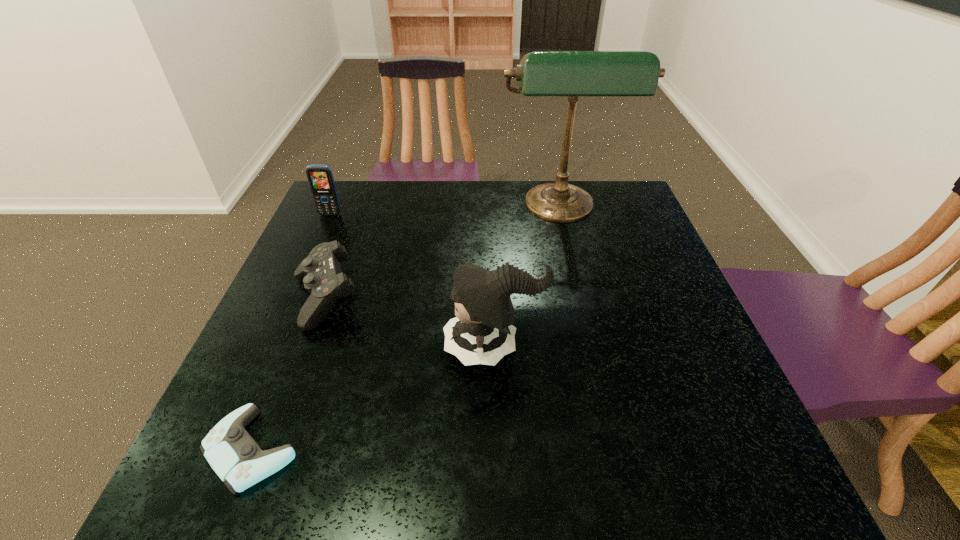
At what (x,y) coordinates should I click in order to perform the action: click on object that is at the near left corner. Please return your answer as a coordinate pair (x, y). Looking at the image, I should click on (233, 454).

Locate an element on the screen. object present at the far right corner is located at coordinates (541, 73).

You are a GUI agent. You are given a task and a screenshot of the screen. Output one action in this format:
    pyautogui.click(x=<x>, y=<y>)
    Task: Click on the free location at the far edge
    
    Given the screenshot: What is the action you would take?
    pyautogui.click(x=467, y=218)

I want to click on free region at the near edge of the desktop, so click(351, 480).

At what (x,y) coordinates should I click in order to perform the action: click on vacant space at the left edge of the desktop. Please return your answer as a coordinate pair (x, y). The height and width of the screenshot is (540, 960). Looking at the image, I should click on (285, 410).

This screenshot has width=960, height=540. I want to click on free region at the right edge of the desktop, so click(695, 392).

The height and width of the screenshot is (540, 960). Find the location of `free location at the far left corner of the desktop`. free location at the far left corner of the desktop is located at coordinates (365, 185).

This screenshot has height=540, width=960. In order to click on vacant space at the near left corner of the desktop in this screenshot , I will do `click(280, 478)`.

The height and width of the screenshot is (540, 960). I want to click on blank space at the far right corner of the desktop, so click(616, 224).

This screenshot has width=960, height=540. Find the location of `vacant area at the near right corner of the desktop`. vacant area at the near right corner of the desktop is located at coordinates (709, 465).